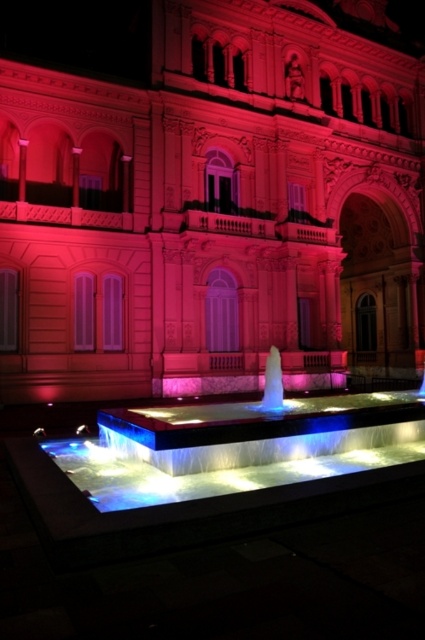
Is matte pink stone palace at center to the left of illuminated glass water feature at center from the viewer's perspective?

Correct, you'll find matte pink stone palace at center to the left of illuminated glass water feature at center.

Who is positioned more to the right, matte pink stone palace at center or illuminated glass water feature at center?

illuminated glass water feature at center is more to the right.

Identify the location of matte pink stone palace at center. (217, 208).

Identify the location of matte pink stone palace at center. (217, 208).

Between illuminated glass water feature at center and illuminated glass fountain at center, which one appears on the right side from the viewer's perspective?

illuminated glass fountain at center is more to the right.

Can you confirm if illuminated glass water feature at center is shorter than illuminated glass fountain at center?

Yes, illuminated glass water feature at center is shorter than illuminated glass fountain at center.

Who is more distant from viewer, (x=210, y=406) or (x=280, y=390)?

Positioned behind is point (x=280, y=390).

Identify the location of illuminated glass water feature at center. This screenshot has width=425, height=640. (231, 449).

Is matte pink stone palace at center below illuminated glass fountain at center?

No, matte pink stone palace at center is not below illuminated glass fountain at center.

Is matte pink stone palace at center above illuminated glass fountain at center?

Indeed, matte pink stone palace at center is positioned over illuminated glass fountain at center.

The image size is (425, 640). I want to click on matte pink stone palace at center, so click(x=217, y=208).